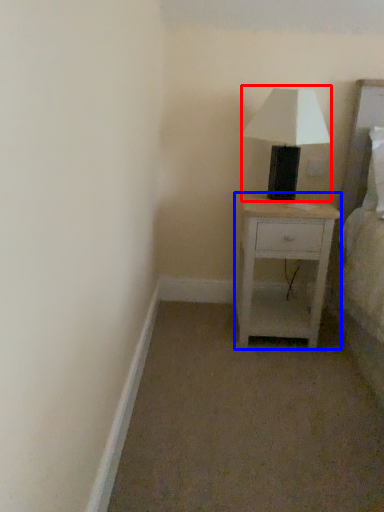
Question: Which of the following is the farthest to the observer, table lamp (highlighted by a red box) or nightstand (highlighted by a blue box)?

Choices:
 (A) table lamp
 (B) nightstand

Answer: (B)